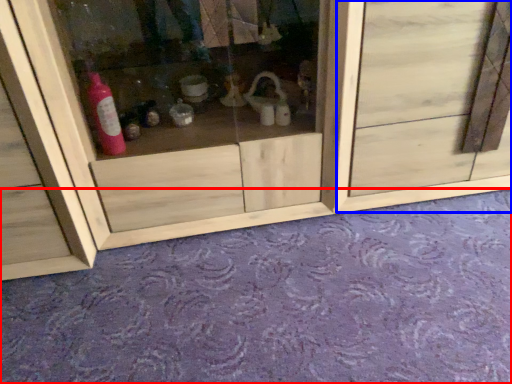
Question: Which object appears closest to the camera in this image, plain (highlighted by a red box) or door (highlighted by a blue box)?

Choices:
 (A) plain
 (B) door

Answer: (A)